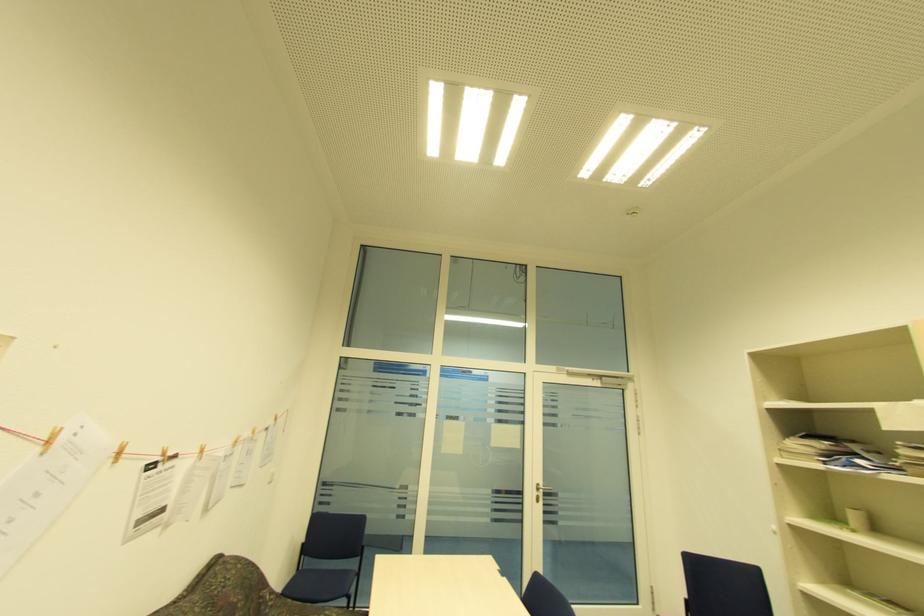
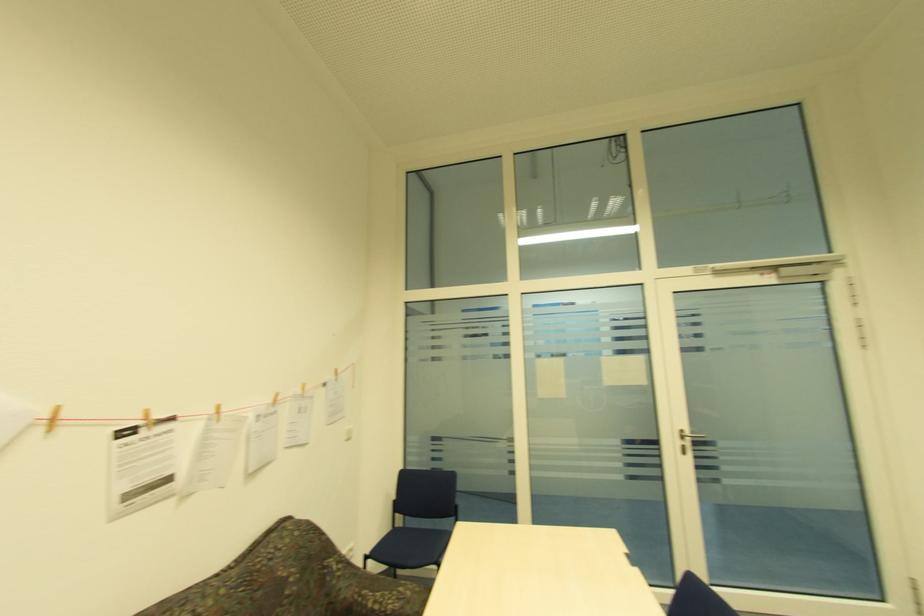
The point at [203,453] is marked in the first image. Where is the corresponding point in the second image?

(219, 413)